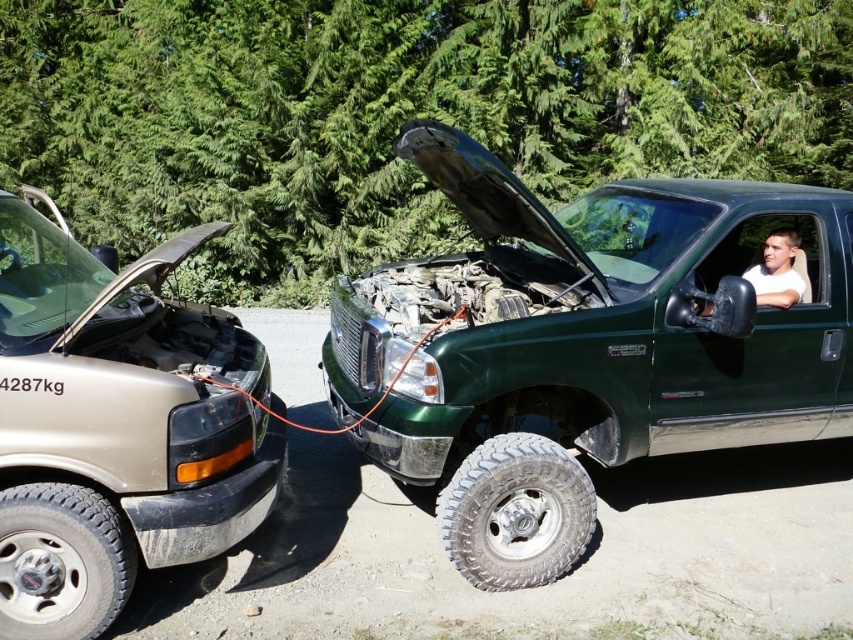
You are a delivery driver who needs to park your truck in a narrow alley that can only accommodate vehicles up to the width of the silver metallic tire at lower center. Based on the scene, can the green matte truck at center fit into this alley?

The green matte truck at center might be wider than silver metallic tire at lower center, so it may not fit in the alley designed for the tire width.

From the picture: You are a driver who needs to exit the forest area. You see a green matte truck at center and a matte black truck at left. Which truck is positioned higher in the image?

The green matte truck at center is above matte black truck at left in the image.